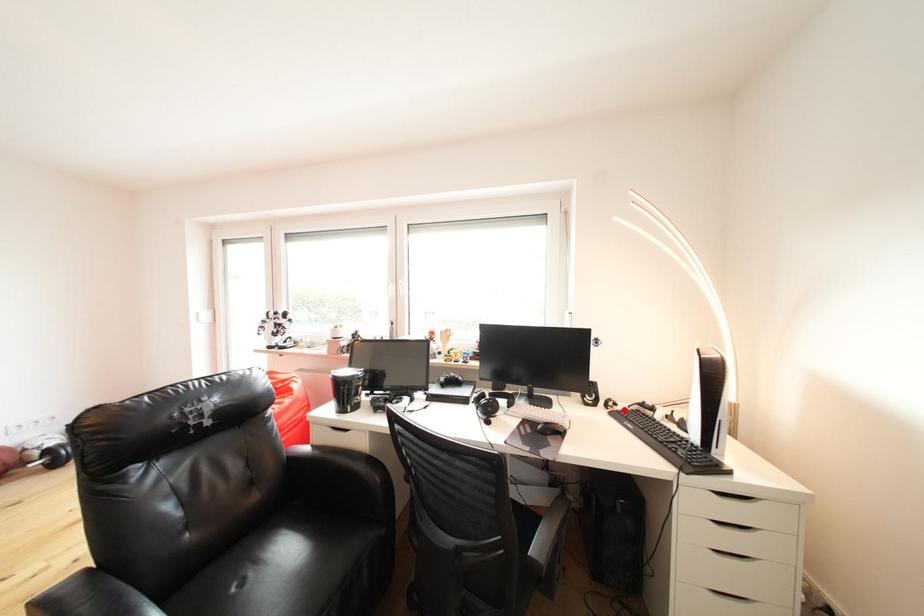
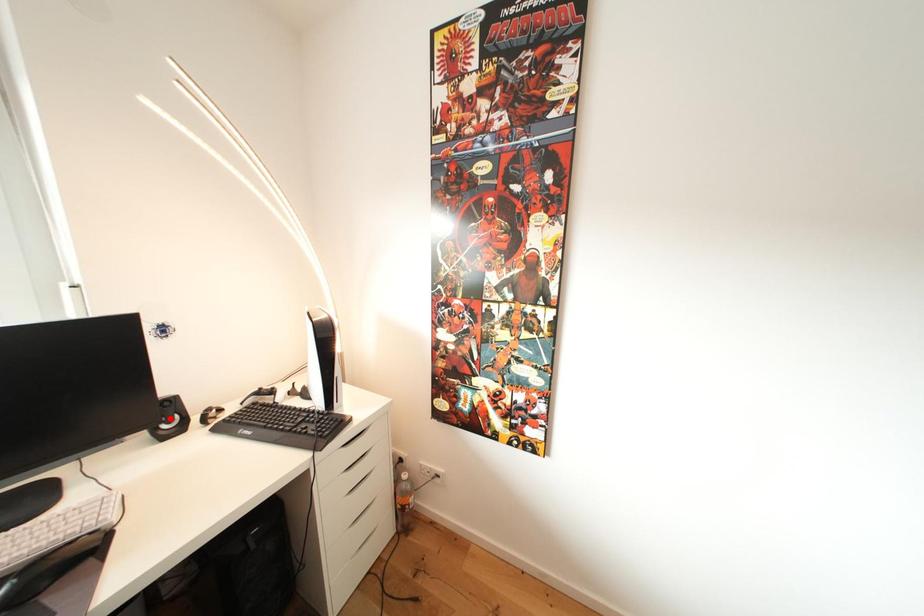
I am providing you with two images of the same scene from different viewpoints. A red point is marked on the first image and another point is marked on the second image. Do the highlighted points in image1 and image2 indicate the same real-world spot?

No